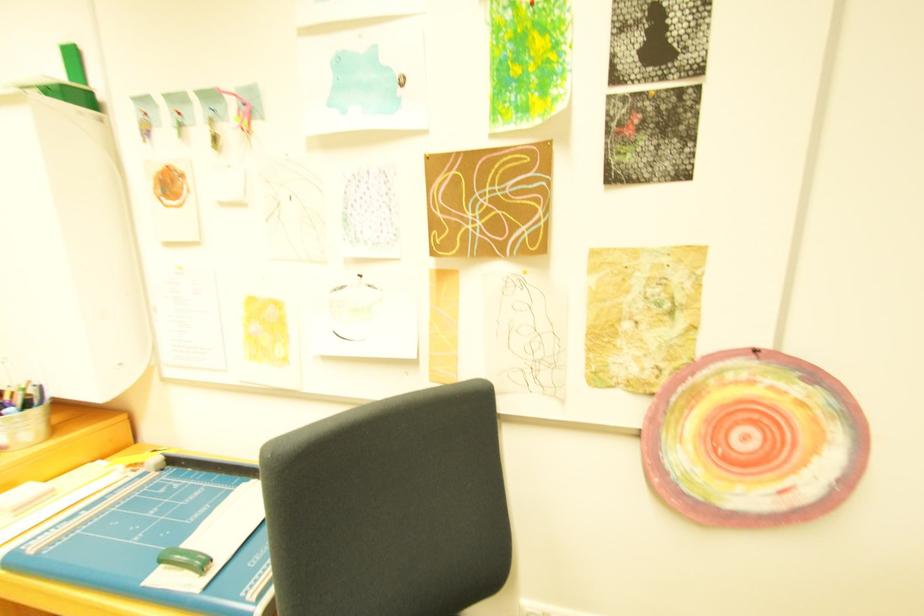
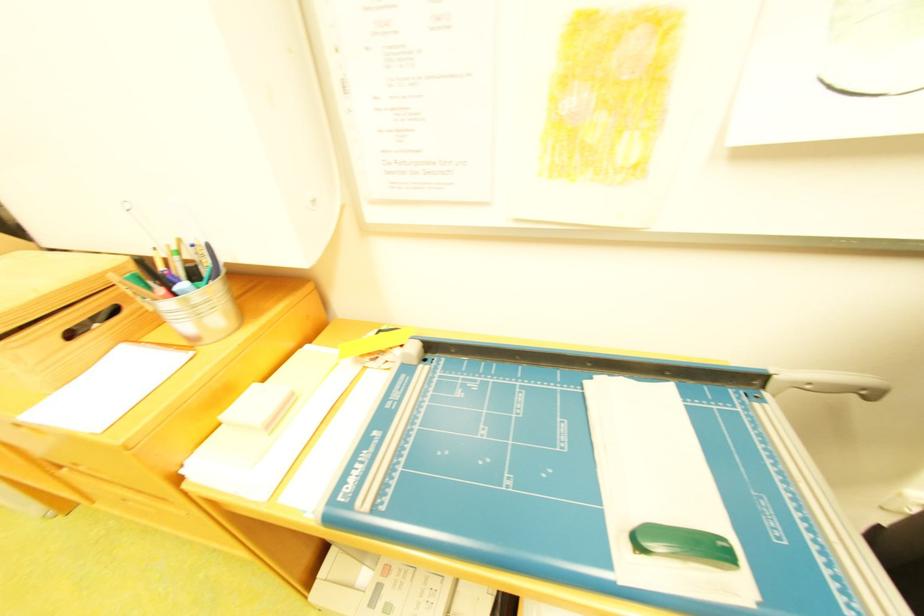
In a continuous first-person perspective shot, in which direction is the camera moving?

The cameraman moved toward left, forward.